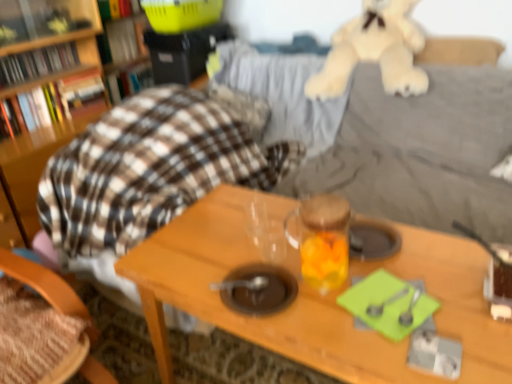
What are the coordinates of `blank space above wooden table at center (from a real-world perspective)` in the screenshot? It's located at (328, 280).